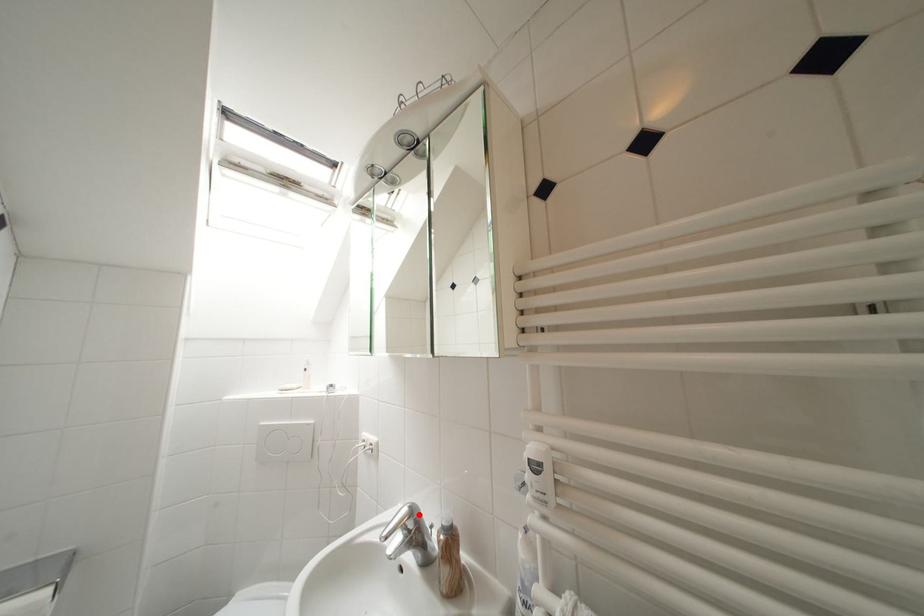
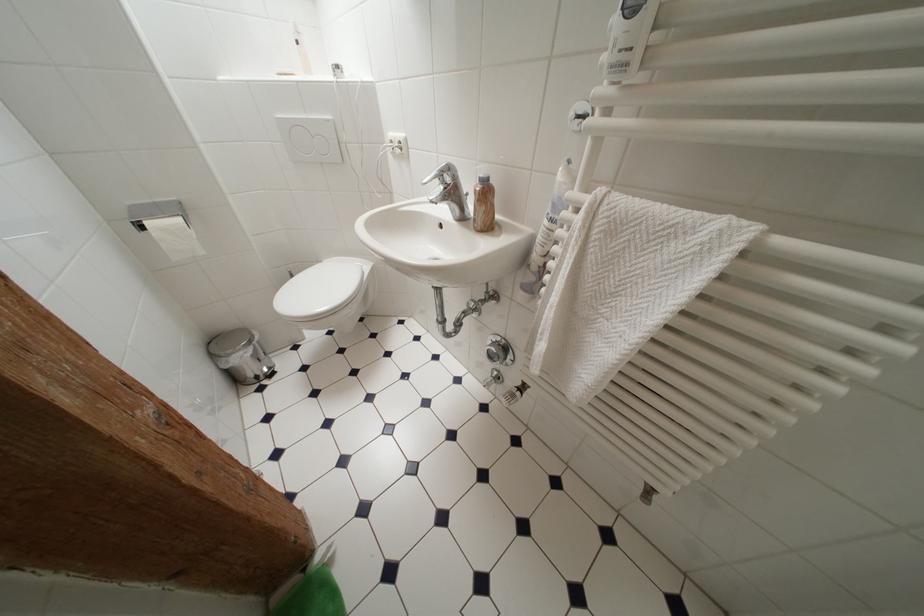
Locate, in the second image, the point that corresponds to the highlighted location in the first image.

(456, 171)